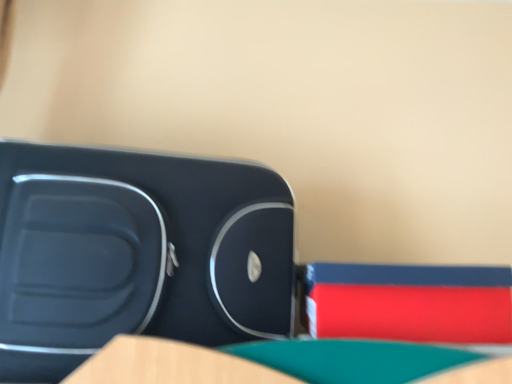
In order to face matte plastic suitcase at left, should I rotate leftwards or rightwards?

Turn left by 16.680 degrees to look at matte plastic suitcase at left.

Describe the element at coordinates (136, 253) in the screenshot. I see `matte plastic suitcase at left` at that location.

Identify the location of matte plastic suitcase at left. Image resolution: width=512 pixels, height=384 pixels. point(136,253).

Where is `rubberized red book at right`? rubberized red book at right is located at coordinates (410, 303).

This screenshot has width=512, height=384. What do you see at coordinates (410, 303) in the screenshot? I see `rubberized red book at right` at bounding box center [410, 303].

Find the location of `matte plastic suitcase at left`. matte plastic suitcase at left is located at coordinates (136, 253).

Considering the relative positions of rubberized red book at right and matte plastic suitcase at left in the image provided, is rubberized red book at right to the left of matte plastic suitcase at left from the viewer's perspective?

No, rubberized red book at right is not to the left of matte plastic suitcase at left.

Is the depth of rubberized red book at right less than that of matte plastic suitcase at left?

No, rubberized red book at right is further to the viewer.

Is point (443, 336) less distant than point (38, 248)?

No.

From the image's perspective, does rubberized red book at right appear lower than matte plastic suitcase at left?

Correct, rubberized red book at right appears lower than matte plastic suitcase at left in the image.

From a real-world perspective, between rubberized red book at right and matte plastic suitcase at left, who is vertically higher?

matte plastic suitcase at left, from a real-world perspective.

From the picture: Does rubberized red book at right have a greater width compared to matte plastic suitcase at left?

No, rubberized red book at right is not wider than matte plastic suitcase at left.

Can you confirm if rubberized red book at right is shorter than matte plastic suitcase at left?

Correct, rubberized red book at right is not as tall as matte plastic suitcase at left.

Does rubberized red book at right have a smaller size compared to matte plastic suitcase at left?

Correct, rubberized red book at right occupies less space than matte plastic suitcase at left.

Is matte plastic suitcase at left inside rubberized red book at right?

Definitely not — matte plastic suitcase at left is not inside rubberized red book at right.

Can you see rubberized red book at right touching matte plastic suitcase at left?

rubberized red book at right and matte plastic suitcase at left are clearly separated.

In the scene shown: Is rubberized red book at right positioned with its back to matte plastic suitcase at left?

rubberized red book at right is not turned away from matte plastic suitcase at left.

Where is `paperback book that appears on the right of matte plastic suitcase at left`? paperback book that appears on the right of matte plastic suitcase at left is located at coordinates (410, 303).

Does matte plastic suitcase at left appear on the left side of rubberized red book at right?

Yes, matte plastic suitcase at left is to the left of rubberized red book at right.

Does matte plastic suitcase at left lie in front of rubberized red book at right?

Yes, it is.

Between point (201, 309) and point (489, 305), which one is positioned behind?

The point (201, 309) is more distant.

Looking at this image, from the image's perspective, between matte plastic suitcase at left and rubberized red book at right, who is located below?

rubberized red book at right is shown below in the image.

From a real-world perspective, who is located lower, matte plastic suitcase at left or rubberized red book at right?

In real-world perspective, rubberized red book at right is lower.

Is matte plastic suitcase at left wider than rubberized red book at right?

Indeed, matte plastic suitcase at left has a greater width compared to rubberized red book at right.

Can you confirm if matte plastic suitcase at left is taller than rubberized red book at right?

Indeed, matte plastic suitcase at left has a greater height compared to rubberized red book at right.

Which of these two, matte plastic suitcase at left or rubberized red book at right, is bigger?

With larger size is matte plastic suitcase at left.

Is matte plastic suitcase at left located outside rubberized red book at right?

Yes, matte plastic suitcase at left is outside of rubberized red book at right.

Is matte plastic suitcase at left not close to rubberized red book at right?

No.

Could you tell me if matte plastic suitcase at left is turned towards rubberized red book at right?

No, matte plastic suitcase at left is not oriented towards rubberized red book at right.

Can you tell me how much matte plastic suitcase at left and rubberized red book at right differ in facing direction?

They differ by 0.000592 degrees in their facing directions.

Image resolution: width=512 pixels, height=384 pixels. Identify the location of paperback book lying on the right of matte plastic suitcase at left. (410, 303).

Locate an element on the screen. This screenshot has height=384, width=512. paperback book below the matte plastic suitcase at left (from the image's perspective) is located at coordinates (410, 303).

Where is `turquoise in front of the rubberized red book at right`? The height and width of the screenshot is (384, 512). turquoise in front of the rubberized red book at right is located at coordinates (136, 253).